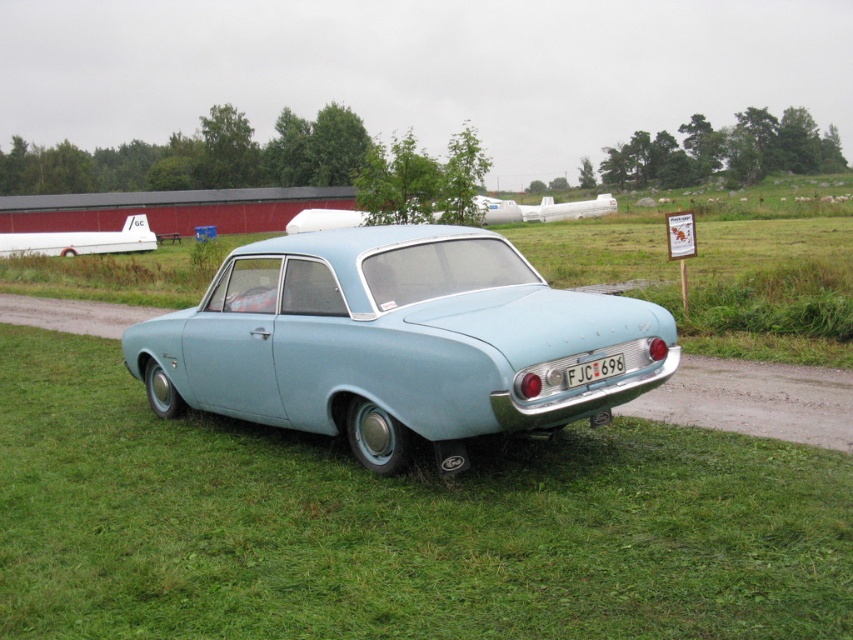
Does light blue matte car at center have a lesser width compared to white plastic license plate at center?

Incorrect, light blue matte car at center's width is not less than white plastic license plate at center's.

Where is `light blue matte car at center`? The width and height of the screenshot is (853, 640). light blue matte car at center is located at coordinates (395, 342).